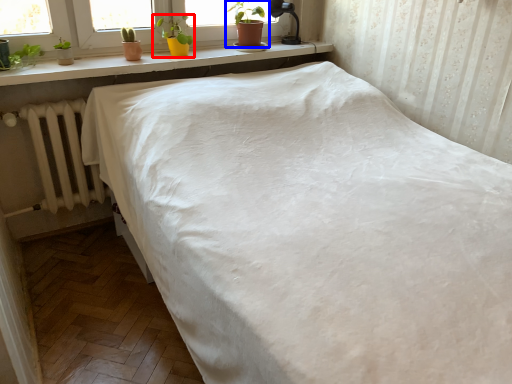
Question: Among these objects, which one is farthest to the camera, houseplant (highlighted by a red box) or houseplant (highlighted by a blue box)?

Choices:
 (A) houseplant
 (B) houseplant

Answer: (B)